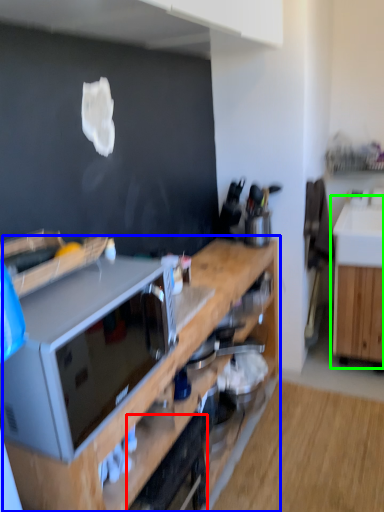
Question: Which object is positioned farthest from appliance (highlighted by a red box)? Select from cabinetry (highlighted by a blue box) and cabinetry (highlighted by a green box).

Choices:
 (A) cabinetry
 (B) cabinetry

Answer: (B)